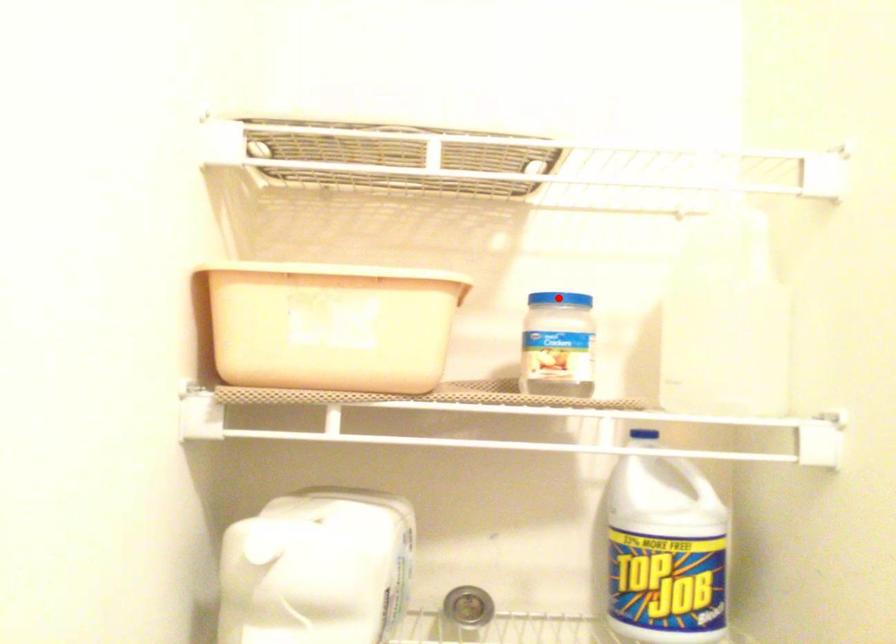
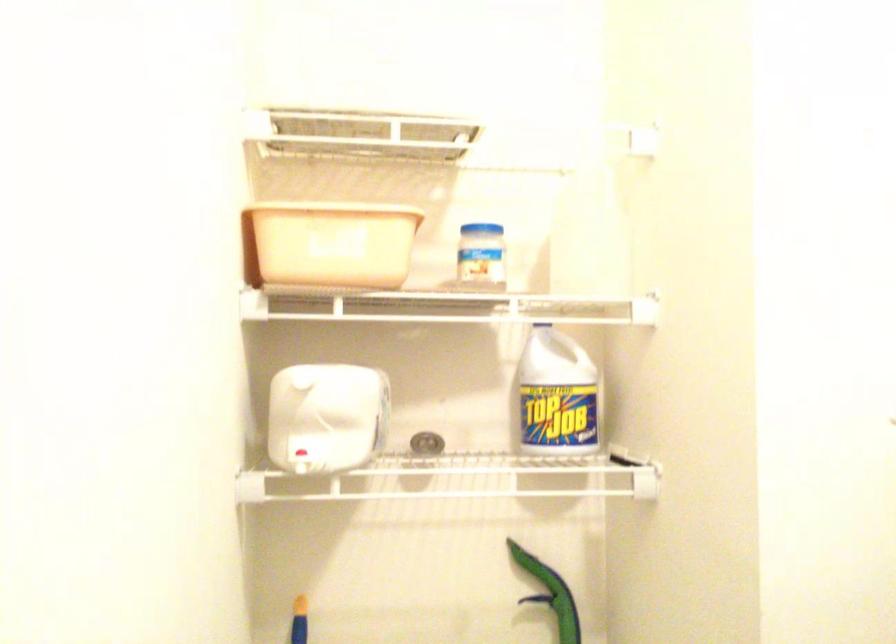
In the second image, find the point that corresponds to the highlighted location in the first image.

(479, 225)